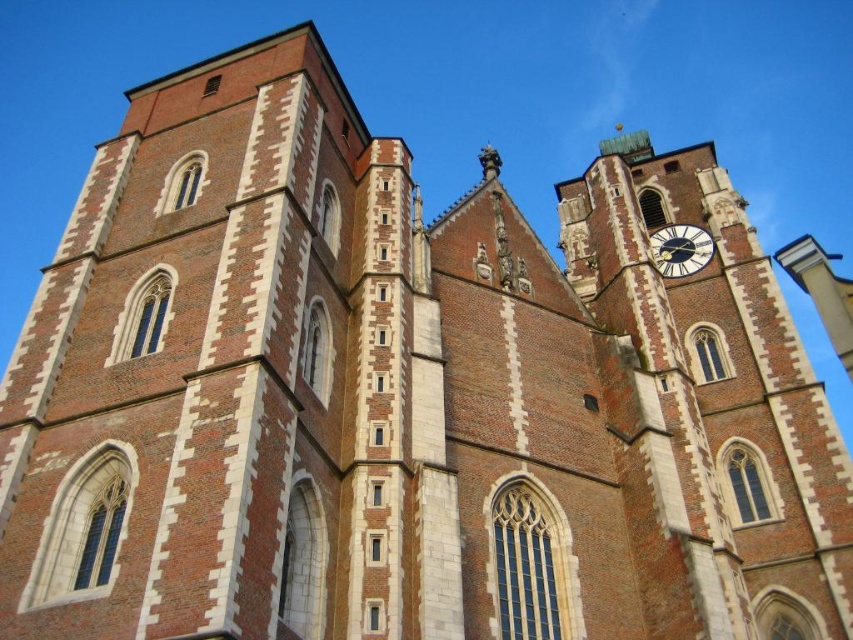
Measure the distance from brick and stone clock tower at center to blue painted metal clock at upper right.

brick and stone clock tower at center and blue painted metal clock at upper right are 7.82 meters apart from each other.

Is point (787, 312) farther from camera compared to point (712, 252)?

No, (787, 312) is in front of (712, 252).

This screenshot has width=853, height=640. Describe the element at coordinates (711, 404) in the screenshot. I see `brick and stone clock tower at center` at that location.

Find the location of `brick and stone clock tower at center`. brick and stone clock tower at center is located at coordinates (711, 404).